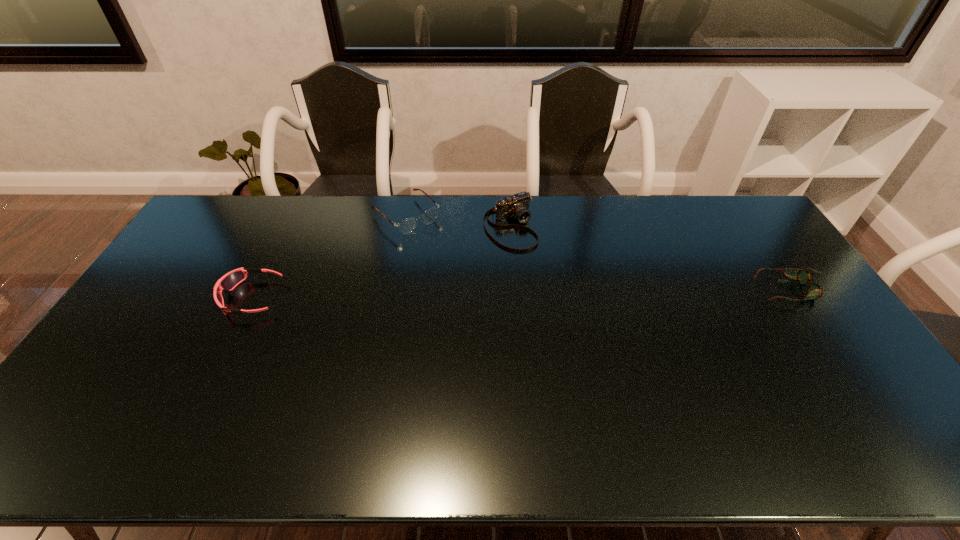
The height and width of the screenshot is (540, 960). In order to click on vacant area that lies between the third object from left to right and the farther spectacles in this screenshot , I will do `click(458, 221)`.

Where is `free space between the goggles and the nearer spectacles`? This screenshot has height=540, width=960. free space between the goggles and the nearer spectacles is located at coordinates (522, 293).

This screenshot has width=960, height=540. I want to click on free spot between the leftmost object and the camera, so click(381, 262).

Locate an element on the screen. The width and height of the screenshot is (960, 540). empty space between the third object from left to right and the shorter spectacles is located at coordinates (651, 258).

Identify the location of vacant area between the second object from left to right and the goggles. (329, 256).

Identify the location of free space between the second object from left to right and the rightmost object. (599, 253).

Locate an element on the screen. The width and height of the screenshot is (960, 540). vacant region between the farther spectacles and the second object from right to left is located at coordinates (458, 221).

Identify the location of free spot between the shorter spectacles and the farther spectacles. (599, 253).

I want to click on free space between the goggles and the second object from right to left, so click(x=381, y=262).

The width and height of the screenshot is (960, 540). Find the location of `the closest object relative to the leftmost object`. the closest object relative to the leftmost object is located at coordinates (406, 226).